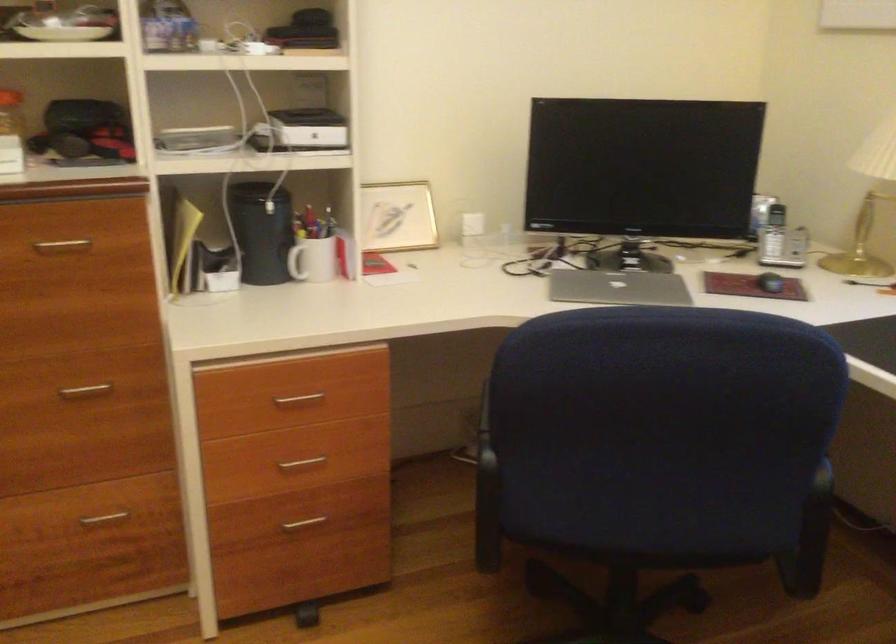
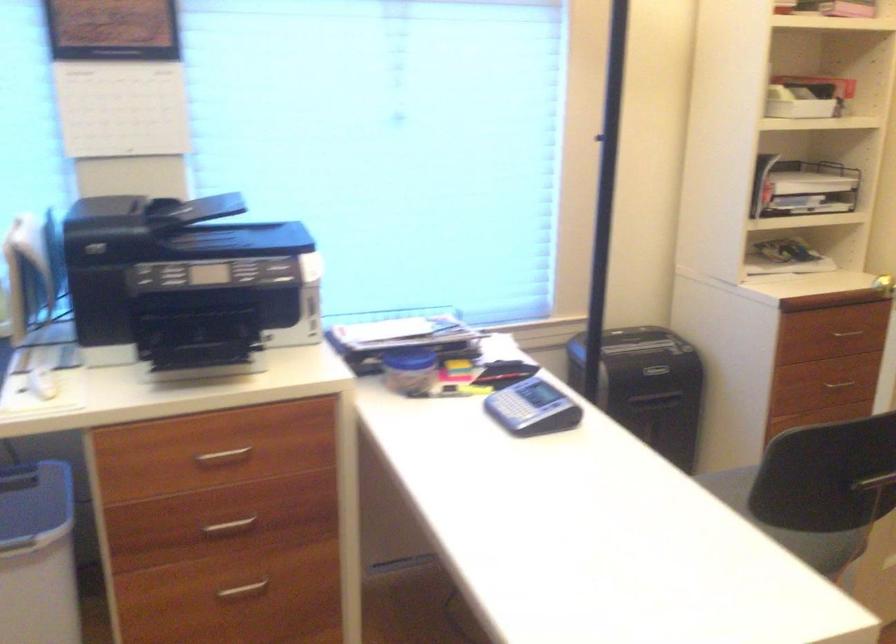
Looking at this image, how did the camera likely rotate?

The camera's rotation is toward right-down.